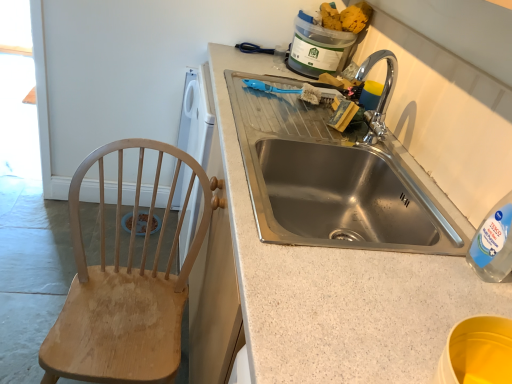
Question: Is stainless steel sink at center bigger or smaller than granite countertop at center?

Choices:
 (A) big
 (B) small

Answer: (B)

Question: Considering their positions, is stainless steel sink at center located in front of or behind granite countertop at center?

Choices:
 (A) behind
 (B) front

Answer: (A)

Question: Which object is the closest to the wooden chair at left?

Choices:
 (A) yellow sponge at upper right
 (B) granite countertop at center
 (C) stainless steel sink at center

Answer: (C)

Question: Which is farther from the stainless steel sink at center?

Choices:
 (A) yellow sponge at upper right
 (B) wooden chair at left
 (C) granite countertop at center

Answer: (A)